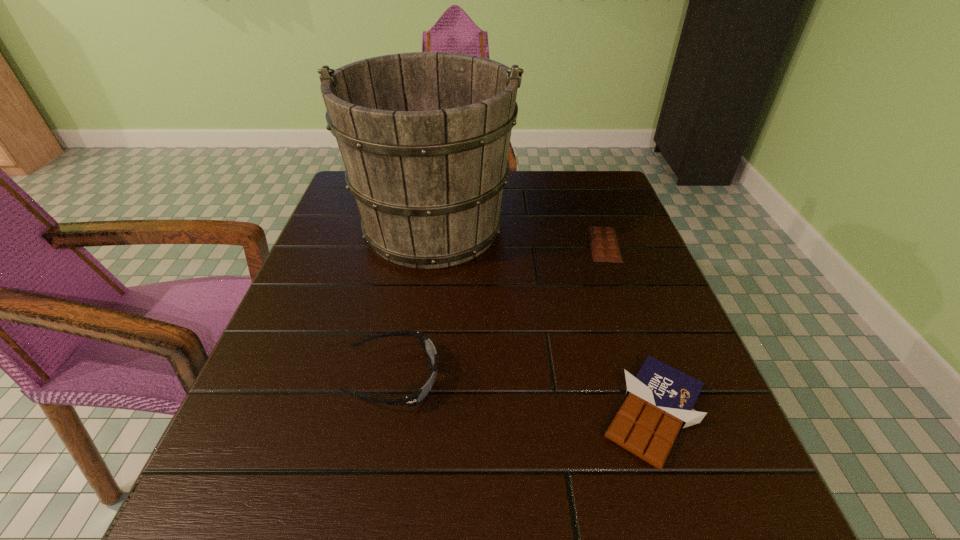
At what (x,y) coordinates should I click in order to perform the action: click on bucket that is at the left edge. Please return your answer as a coordinate pair (x, y). Looking at the image, I should click on (424, 136).

In order to click on sunglasses located at the left edge in this screenshot , I will do `click(419, 395)`.

Where is `object present at the far left corner`? object present at the far left corner is located at coordinates (424, 136).

In order to click on vacant point at the far edge in this screenshot , I will do `click(543, 181)`.

In the image, there is a desktop. Where is `free space at the near edge`? This screenshot has width=960, height=540. free space at the near edge is located at coordinates (611, 520).

Locate an element on the screen. This screenshot has height=540, width=960. vacant region at the left edge of the desktop is located at coordinates (300, 473).

Find the location of `vacant space at the right edge of the desktop`. vacant space at the right edge of the desktop is located at coordinates (608, 289).

At what (x,y) coordinates should I click in order to perform the action: click on vacant space at the near left corner of the desktop. Please return your answer as a coordinate pair (x, y). This screenshot has height=540, width=960. Looking at the image, I should click on (201, 519).

The height and width of the screenshot is (540, 960). What are the coordinates of `vacant point at the far right corner` in the screenshot? It's located at (611, 188).

Where is `vacant area that lies between the sunglasses and the shorter chocolate bar`? Image resolution: width=960 pixels, height=540 pixels. vacant area that lies between the sunglasses and the shorter chocolate bar is located at coordinates (499, 312).